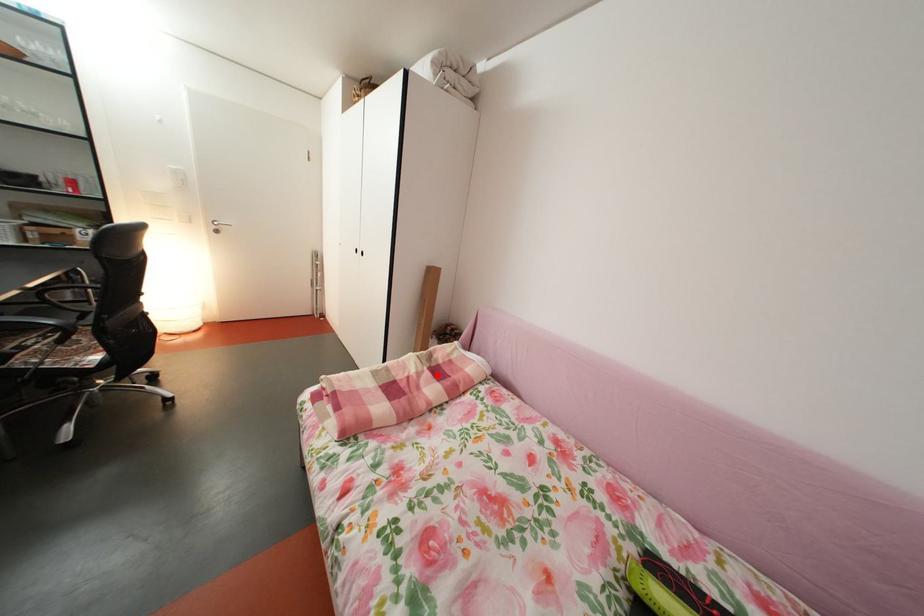
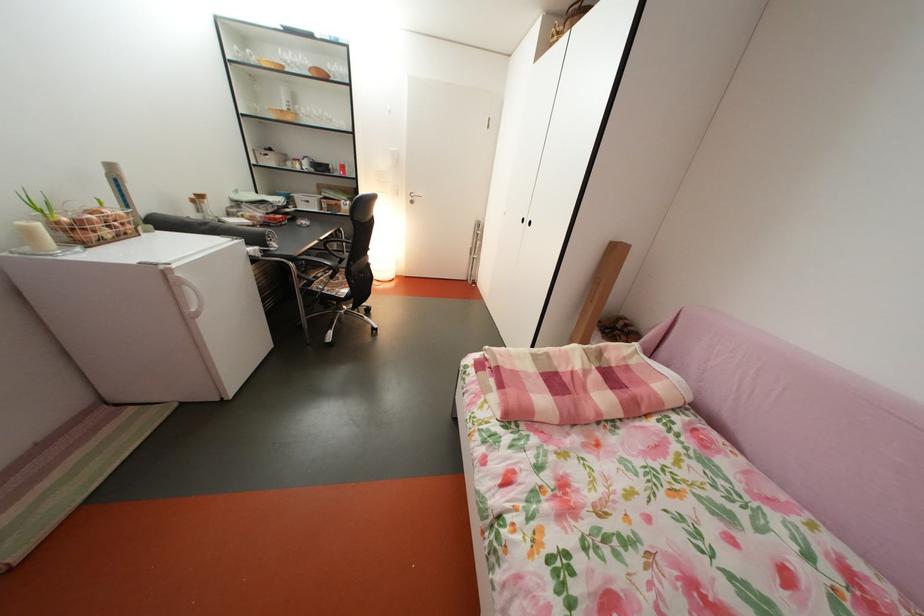
Find the pixel in the second image that matches the highlighted location in the first image.

(604, 374)